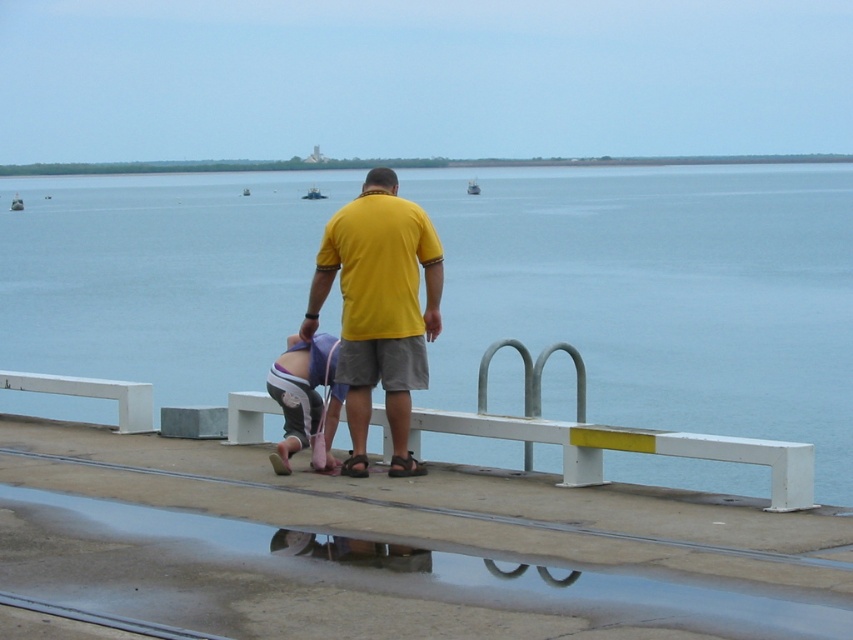
Question: Can you confirm if blue water at center is bigger than pink fabric diaper at lower center?

Choices:
 (A) yes
 (B) no

Answer: (A)

Question: Which object is farther from the camera taking this photo?

Choices:
 (A) blue water at center
 (B) yellow matte shirt at center
 (C) pink fabric diaper at lower center

Answer: (C)

Question: Which point is farther from the camera taking this photo?

Choices:
 (A) (x=372, y=253)
 (B) (x=202, y=275)
 (C) (x=329, y=336)

Answer: (B)

Question: Which of the following is the farthest from the observer?

Choices:
 (A) (314, 273)
 (B) (589, 352)
 (C) (300, 355)

Answer: (B)

Question: Can you confirm if yellow matte shirt at center is wider than pink fabric diaper at lower center?

Choices:
 (A) no
 (B) yes

Answer: (B)

Question: Does yellow matte shirt at center appear under pink fabric diaper at lower center?

Choices:
 (A) no
 (B) yes

Answer: (A)